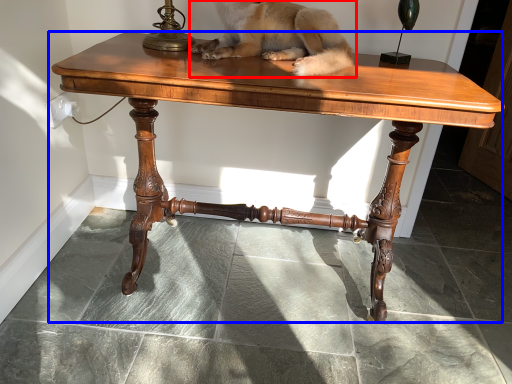
Question: Which point is further to the camera, dog (highlighted by a red box) or table (highlighted by a blue box)?

Choices:
 (A) dog
 (B) table

Answer: (A)